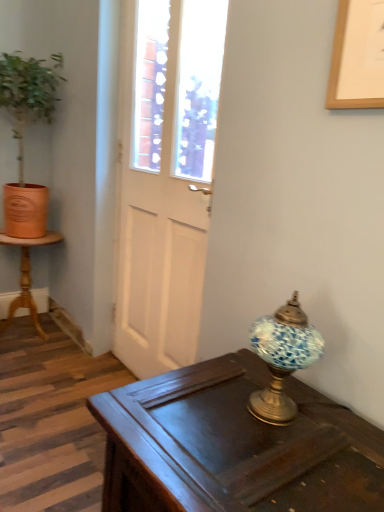
This screenshot has height=512, width=384. In order to click on vacant space positioned to the left of white glossy door at center in this screenshot , I will do `click(69, 381)`.